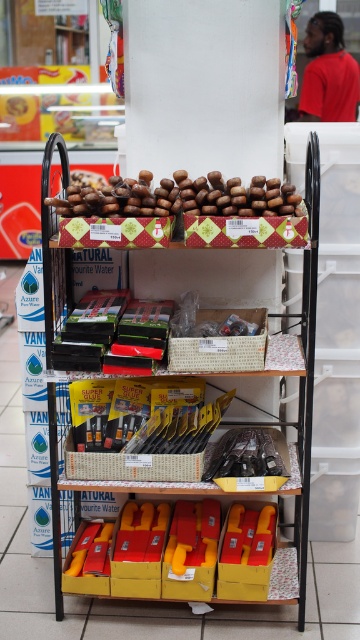
Consider the image. You are a customer trying to reach an item on the top shelf of the retail display stand. You have a grabber tool with a width of 10 cm. The grabber can extend to the shelf but you need to ensure it can fit between the wooden handles at upper center and the wooden beads at center. Can the grabber fit between them?

The wooden handles at upper center are wider than the wooden beads at center. Since the grabber is 10 cm wide, we need to know the exact width of the gap between them. However, the provided information only states that the handles are wider than the beads, not the actual gap size. Therefore, it is impossible to determine if the grabber will fit without more specific measurements.

You are a customer in a store and you want to reach an item on the top shelf. You see the wooden handles at upper center and the wooden beads at center. Which one is taller and can help you reach higher?

The wooden handles at upper center is taller than the wooden beads at center, so it can help you reach higher.

You are a customer in a store holding a 2.5 feet wide box. You want to place it between the wooden handles at upper center and the camera. Is there enough space?

The wooden handles at upper center and the camera are 6.63 feet apart from each other. Since the box is 2.5 feet wide, there is enough space to place it between them as 6.63 feet is greater than 2.5 feet.